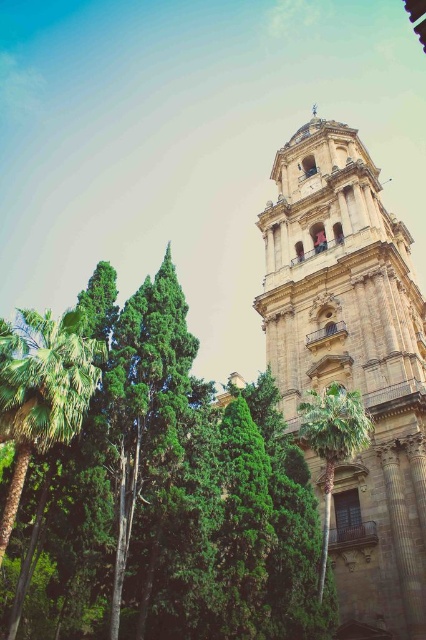
Question: Does golden stone bell tower at right come behind green leafy palm tree at lower left?

Choices:
 (A) yes
 (B) no

Answer: (A)

Question: Considering the real-world distances, which object is closest to the green leafy tree at center?

Choices:
 (A) golden stone bell tower at right
 (B) green leafy palm tree at lower left

Answer: (B)

Question: Is green leafy tree at center further to camera compared to green leafy palm tree at center?

Choices:
 (A) no
 (B) yes

Answer: (A)

Question: Which object is positioned closest to the green leafy palm tree at lower left?

Choices:
 (A) golden stone bell tower at right
 (B) green leafy tree at center

Answer: (B)

Question: Considering the real-world distances, which object is closest to the green leafy palm tree at lower left?

Choices:
 (A) green leafy palm tree at center
 (B) green leafy tree at center

Answer: (B)

Question: In this image, where is green leafy tree at center located relative to green leafy palm tree at center?

Choices:
 (A) left
 (B) right

Answer: (A)